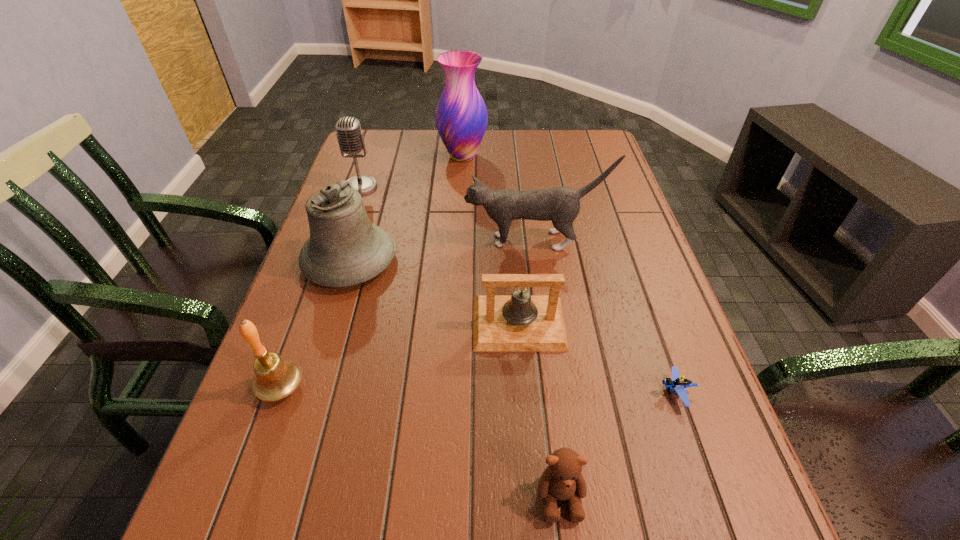
Find the location of `vacant region located 0.270m on the front-facing side of the Lego`. vacant region located 0.270m on the front-facing side of the Lego is located at coordinates (511, 393).

Identify the location of vacant point located on the front-facing side of the Lego. (478, 393).

The width and height of the screenshot is (960, 540). I want to click on free space located 0.200m on the front-facing side of the Lego, so [x=549, y=393].

At what (x,y) coordinates should I click in order to perform the action: click on object situated at the far edge. Please return your answer as a coordinate pair (x, y). Looking at the image, I should click on (461, 118).

In order to click on microphone positioned at the left edge in this screenshot , I will do `click(350, 137)`.

This screenshot has width=960, height=540. In order to click on cat located in the right edge section of the desktop in this screenshot , I will do `click(561, 205)`.

Locate an element on the screen. The height and width of the screenshot is (540, 960). Lego that is at the right edge is located at coordinates (678, 383).

At what (x,y) coordinates should I click in order to perform the action: click on free location at the far edge of the desktop. Please return your answer as a coordinate pair (x, y). Looking at the image, I should click on pos(434,145).

Locate an element on the screen. This screenshot has width=960, height=540. vacant space at the left edge of the desktop is located at coordinates (290, 333).

What are the coordinates of `vacant space at the right edge` in the screenshot? It's located at (582, 246).